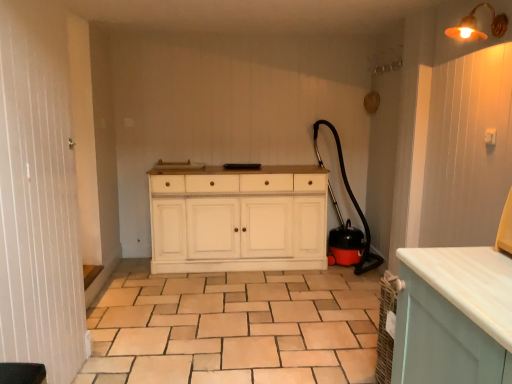
I want to click on white wood cabinet at center, so click(238, 219).

This screenshot has height=384, width=512. Describe the element at coordinates (238, 219) in the screenshot. I see `white wood cabinet at center` at that location.

Measure the distance between white wood screen door at left and camera.

The depth of white wood screen door at left is 1.53 meters.

Identify the location of white wood screen door at left. The height and width of the screenshot is (384, 512). (39, 192).

Measure the distance between black rubber garden hose at right and camera.

black rubber garden hose at right and camera are 3.73 meters apart from each other.

In order to face black rubber garden hose at right, should I rotate leftwards or rightwards?

You should look right and rotate roughly 11.959 degrees.

Image resolution: width=512 pixels, height=384 pixels. Describe the element at coordinates (476, 26) in the screenshot. I see `metallic brass light fixture at upper right` at that location.

Find the location of a particular element. white wood cabinet at center is located at coordinates click(238, 219).

Is white wood screen door at left looking in the opposite direction of black rubber garden hose at right?

No, white wood screen door at left is not facing away from black rubber garden hose at right.

Consider the image. Which object is closer to the camera taking this photo, white wood screen door at left or black rubber garden hose at right?

white wood screen door at left.

Can we say white wood screen door at left lies outside black rubber garden hose at right?

white wood screen door at left lies outside black rubber garden hose at right's area.

Which of these two, white wood screen door at left or black rubber garden hose at right, is bigger?

Bigger between the two is black rubber garden hose at right.

Could you tell me if black rubber garden hose at right is turned towards white wood cabinet at center?

No, black rubber garden hose at right is not facing towards white wood cabinet at center.

From the image's perspective, between black rubber garden hose at right and white wood cabinet at center, which one is located above?

black rubber garden hose at right is shown above in the image.

Which is closer, [370,260] or [291,217]?

Point [370,260] is positioned farther from the camera compared to point [291,217].

Can you confirm if black rubber garden hose at right is bigger than white wood cabinet at center?

No, black rubber garden hose at right is not bigger than white wood cabinet at center.

Is white wood screen door at left located outside white wood cabinet at center?

Indeed, white wood screen door at left is completely outside white wood cabinet at center.

Is point (41, 60) closer or farther from the camera than point (313, 185)?

Point (41, 60).

How far apart are white wood screen door at left and white wood cabinet at center?

They are 5.37 feet apart.

From the picture: Between white wood screen door at left and white wood cabinet at center, which one has smaller width?

white wood screen door at left is thinner.

In the image, is metallic brass light fixture at upper right positioned in front of or behind white wood screen door at left?

In the image, metallic brass light fixture at upper right appears behind white wood screen door at left.

From the image's perspective, between metallic brass light fixture at upper right and white wood screen door at left, who is located below?

white wood screen door at left appears lower in the image.

Does point (462, 36) appear closer or farther from the camera than point (37, 149)?

Point (462, 36) appears to be farther away from the viewer than point (37, 149).

How different are the orientations of white wood cabinet at center and black rubber garden hose at right in degrees?

3.17 degrees.

From a real-world perspective, is white wood cabinet at center under black rubber garden hose at right?

Yes, from a real-world perspective, white wood cabinet at center is below black rubber garden hose at right.

Which object is thinner, white wood cabinet at center or black rubber garden hose at right?

Thinner between the two is white wood cabinet at center.

Considering the positions of points (312, 229) and (369, 253), is point (312, 229) farther from camera compared to point (369, 253)?

That is False.

Is black rubber garden hose at right far away from metallic brass light fixture at upper right?

That's right, there is a large distance between black rubber garden hose at right and metallic brass light fixture at upper right.

Is black rubber garden hose at right turned away from metallic brass light fixture at upper right?

black rubber garden hose at right does not have its back to metallic brass light fixture at upper right.

From the image's perspective, is black rubber garden hose at right located above or below metallic brass light fixture at upper right?

black rubber garden hose at right is below metallic brass light fixture at upper right.

From a real-world perspective, between black rubber garden hose at right and metallic brass light fixture at upper right, who is vertically lower?

black rubber garden hose at right.

Between beige ceramic tile at center and black rubber garden hose at right, which one has larger size?

black rubber garden hose at right is bigger.

Based on the photo, is beige ceramic tile at center to the left of black rubber garden hose at right from the viewer's perspective?

Indeed, beige ceramic tile at center is positioned on the left side of black rubber garden hose at right.

Is point (346, 296) farther from camera compared to point (358, 212)?

No.

The image size is (512, 384). In order to click on screen door below the black rubber garden hose at right (from the image's perspective) in this screenshot , I will do `click(39, 192)`.

The height and width of the screenshot is (384, 512). Find the location of `garden hose above the white wood cabinet at center (from the image's perspective)`. garden hose above the white wood cabinet at center (from the image's perspective) is located at coordinates (351, 200).

When comparing their distances from metallic brass light fixture at upper right, does beige ceramic tile at center or white wood cabinet at center seem further?

beige ceramic tile at center lies further to metallic brass light fixture at upper right than the other object.

Based on their spatial positions, is beige ceramic tile at center or black rubber garden hose at right closer to white wood screen door at left?

beige ceramic tile at center lies closer to white wood screen door at left than the other object.

In the scene shown: Considering their positions, is metallic brass light fixture at upper right positioned further to white wood screen door at left than beige ceramic tile at center?

The object further to white wood screen door at left is metallic brass light fixture at upper right.

When comparing their distances from beige ceramic tile at center, does metallic brass light fixture at upper right or white wood screen door at left seem closer?

white wood screen door at left is positioned closer to the anchor beige ceramic tile at center.

Estimate the real-world distances between objects in this image. Which object is further from metallic brass light fixture at upper right, white wood cabinet at center or beige ceramic tile at center?

The object further to metallic brass light fixture at upper right is beige ceramic tile at center.

Which object lies nearer to the anchor point white wood cabinet at center, metallic brass light fixture at upper right or white wood screen door at left?

white wood screen door at left.

Which object lies nearer to the anchor point white wood screen door at left, black rubber garden hose at right or beige ceramic tile at center?

beige ceramic tile at center lies closer to white wood screen door at left than the other object.

When comparing their distances from metallic brass light fixture at upper right, does black rubber garden hose at right or white wood screen door at left seem closer?

black rubber garden hose at right lies closer to metallic brass light fixture at upper right than the other object.

Where is `garden hose situated between white wood screen door at left and metallic brass light fixture at upper right from left to right`? The width and height of the screenshot is (512, 384). garden hose situated between white wood screen door at left and metallic brass light fixture at upper right from left to right is located at coordinates (351, 200).

At what (x,y) coordinates should I click in order to perform the action: click on ceramic tile positioned between white wood screen door at left and black rubber garden hose at right from near to far. Please return your answer as a coordinate pair (x, y). This screenshot has width=512, height=384. Looking at the image, I should click on (233, 327).

Where is `light fixture between white wood screen door at left and white wood cabinet at center along the z-axis`? light fixture between white wood screen door at left and white wood cabinet at center along the z-axis is located at coordinates point(476,26).

Find the location of a particular element. This screenshot has width=512, height=384. garden hose located between white wood screen door at left and white wood cabinet at center in the depth direction is located at coordinates (351, 200).